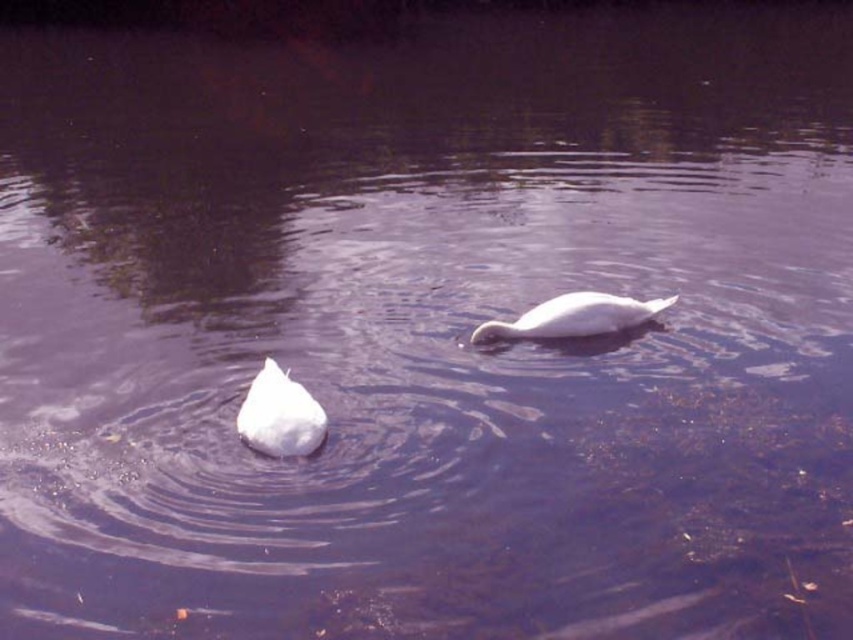
You are standing at the center of the lake and want to reach the white matte swan at lower left. Which direction should you swim to reach it?

Since the white matte swan at lower left is located at coordinates point (279, 416), you should swim towards the lower left direction to reach it.

You are a photographer aiming to capture both swans in a single shot. Given that the white matte swan at lower left is closer to the camera than the white glossy swan at center, which swan will appear larger in your photo?

The white matte swan at lower left will appear larger in the photo because it is closer to the camera than the white glossy swan at center.